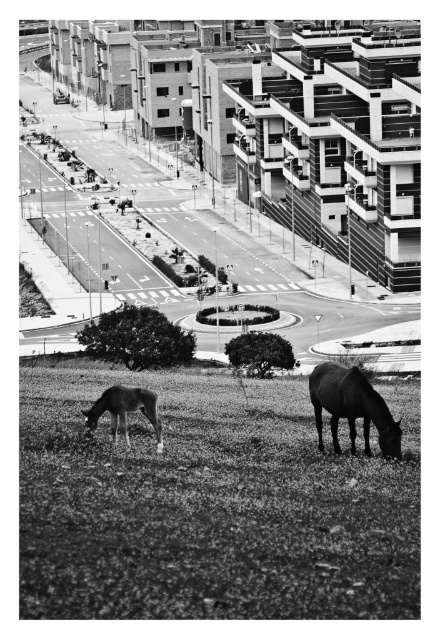
You are a photographer trying to capture both the dark brown horse at lower right and the smooth brown horse at lower left in a single frame. Given their sizes, which horse would you need to position closer to the camera to ensure both appear similarly sized in the photo?

The smooth brown horse at lower left is smaller in width than the dark brown horse at lower right. To make them appear similarly sized in the photo, you should position the smooth brown horse at lower left closer to the camera since it is smaller.

You are a photographer standing at the edge of the grassy field at lower center. You want to take a photo of the dark brown horse at lower right without moving from your current position. Is the horse within your camera lens range if your camera can capture objects up to 20 feet away?

The grassy field at lower center and dark brown horse at lower right are 17.47 feet apart. Since the distance is less than 20 feet, the horse is within the camera lens range.

Based on the photo, you are standing at the center of the roundabout and want to walk towards the grassy field at lower center. Which direction should you face to head directly toward it?

The grassy field at lower center is located at point 0.791 on the x axis and 0.477 on the y axis. Since you are at the center of the roundabout, facing the grassy field at lower center would require facing towards the lower center direction, which corresponds to slightly to the right and downward from your current position.